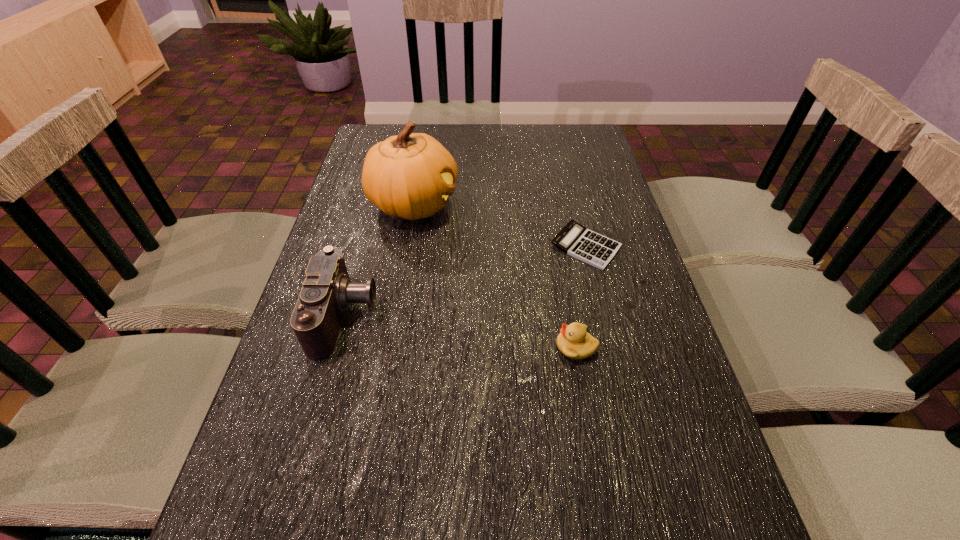
At what (x,y) coordinates should I click in order to perform the action: click on pumpkin. Please return your answer as a coordinate pair (x, y). The image size is (960, 540). Looking at the image, I should click on (410, 175).

Identify the location of camera. (327, 292).

What are the coordinates of `duckling` in the screenshot? It's located at (574, 341).

I want to click on the shortest object, so click(574, 239).

You are a GUI agent. You are given a task and a screenshot of the screen. Output one action in this format:
    pyautogui.click(x=<x>, y=<y>)
    Task: Click on the vacant space situated 0.350m on the front face of the tallest object
    Image resolution: width=960 pixels, height=540 pixels.
    Given the screenshot: What is the action you would take?
    (x=579, y=205)

The height and width of the screenshot is (540, 960). I want to click on free location located 0.330m on the front-facing side of the second tallest object, so click(522, 316).

Where is `vacant point located on the front-facing side of the duckling`? The width and height of the screenshot is (960, 540). vacant point located on the front-facing side of the duckling is located at coordinates (425, 347).

Locate an element on the screen. blank space located on the front-facing side of the duckling is located at coordinates click(486, 347).

Locate an element on the screen. The image size is (960, 540). free space located on the front-facing side of the duckling is located at coordinates (388, 347).

The image size is (960, 540). I want to click on vacant space located on the left of the shortest object, so click(433, 246).